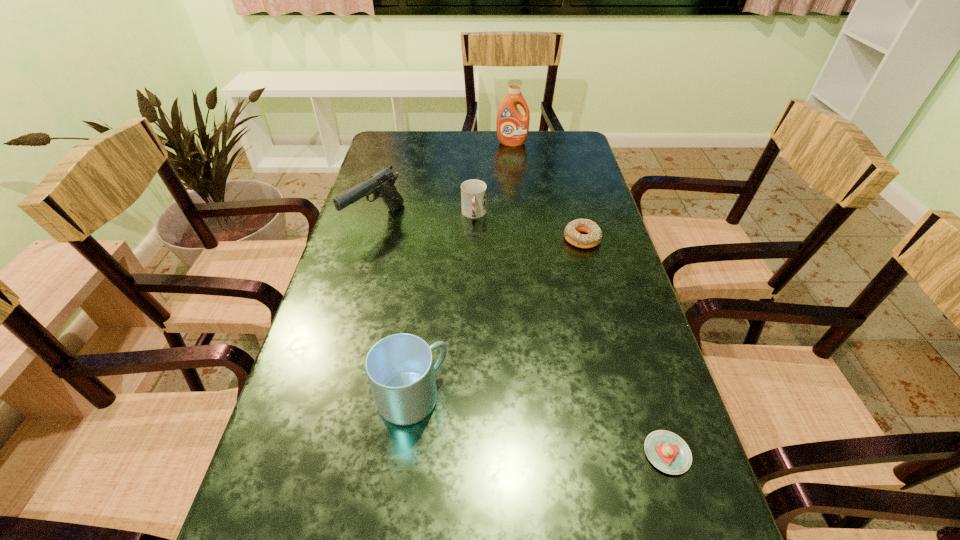
Locate an element on the screen. Image resolution: width=960 pixels, height=540 pixels. vacant point that satisfies the following two spatial constraints: 1. on the front-facing side of the nearest object; 2. on the left side of the fourth object from left to right is located at coordinates (545, 453).

This screenshot has height=540, width=960. Identify the location of vacant space that satisfies the following two spatial constraints: 1. on the front-facing side of the shortest object; 2. on the left side of the fourth object from left to right. (545, 453).

Image resolution: width=960 pixels, height=540 pixels. In order to click on vacant space that satisfies the following two spatial constraints: 1. on the front-facing side of the second shortest object; 2. on the left side of the tallest object in this screenshot , I will do `click(522, 239)`.